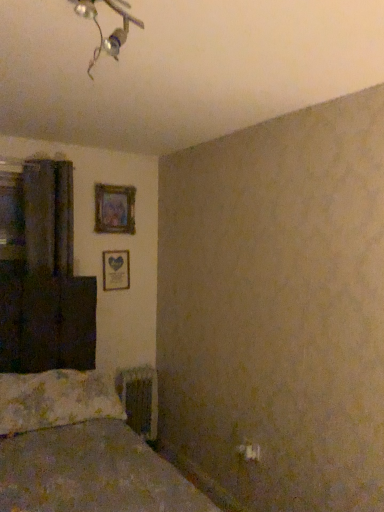
Question: From a real-world perspective, is wooden picture frame at center-left, which appears as the second picture frame when viewed from the top, positioned under wooden frame at upper center, acting as the first picture frame starting from the top, based on gravity?

Choices:
 (A) yes
 (B) no

Answer: (A)

Question: Is wooden picture frame at center-left, which appears as the second picture frame when viewed from the top, aimed at wooden frame at upper center, acting as the first picture frame starting from the top?

Choices:
 (A) yes
 (B) no

Answer: (B)

Question: Can we say wooden picture frame at center-left, the first picture frame from the bottom, lies outside wooden frame at upper center, acting as the first picture frame starting from the top?

Choices:
 (A) no
 (B) yes

Answer: (B)

Question: From the image's perspective, does wooden picture frame at center-left, which appears as the second picture frame when viewed from the top, appear lower than wooden frame at upper center, the 2th picture frame ordered from the bottom?

Choices:
 (A) yes
 (B) no

Answer: (A)

Question: Is the position of wooden picture frame at center-left, which appears as the second picture frame when viewed from the top, more distant than that of wooden frame at upper center, acting as the first picture frame starting from the top?

Choices:
 (A) no
 (B) yes

Answer: (B)

Question: Are wooden picture frame at center-left, the first picture frame from the bottom, and wooden frame at upper center, acting as the first picture frame starting from the top, making contact?

Choices:
 (A) yes
 (B) no

Answer: (B)

Question: Is dark matte curtain at left next to fluffy white pillow at lower left and touching it?

Choices:
 (A) yes
 (B) no

Answer: (B)

Question: From the image's perspective, is dark matte curtain at left above fluffy white pillow at lower left?

Choices:
 (A) no
 (B) yes

Answer: (B)

Question: Can you confirm if dark matte curtain at left is smaller than fluffy white pillow at lower left?

Choices:
 (A) no
 (B) yes

Answer: (B)

Question: Does dark matte curtain at left appear on the right side of fluffy white pillow at lower left?

Choices:
 (A) yes
 (B) no

Answer: (B)

Question: Can you confirm if dark matte curtain at left is bigger than fluffy white pillow at lower left?

Choices:
 (A) no
 (B) yes

Answer: (A)

Question: From a real-world perspective, does dark matte curtain at left sit lower than fluffy white pillow at lower left?

Choices:
 (A) yes
 (B) no

Answer: (B)

Question: Is metallic radiator at lower center looking in the opposite direction of fluffy white pillow at lower left?

Choices:
 (A) yes
 (B) no

Answer: (B)